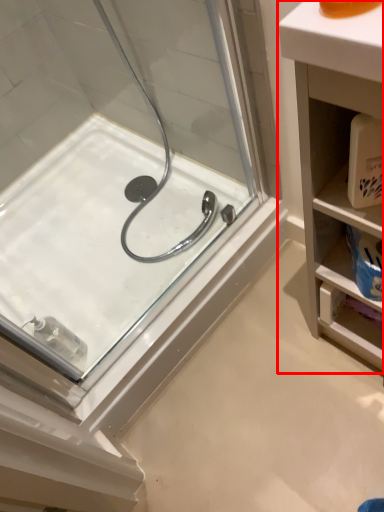
Question: From the image's perspective, where is bathroom cabinet (annotated by the red box) located relative to bath?

Choices:
 (A) above
 (B) below

Answer: (B)